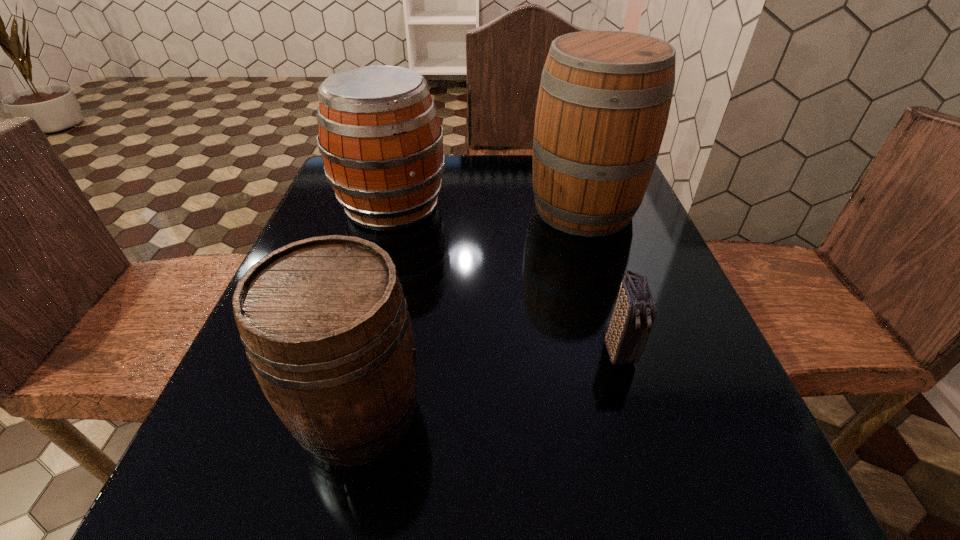
The width and height of the screenshot is (960, 540). In order to click on the tallest cider in this screenshot , I will do `click(604, 99)`.

The image size is (960, 540). Find the location of `the rightmost cider`. the rightmost cider is located at coordinates (604, 99).

Find the location of a particular element. The width and height of the screenshot is (960, 540). the nearest cider is located at coordinates (326, 328).

What are the coordinates of `clutch bag` in the screenshot? It's located at (635, 311).

At what (x,y) coordinates should I click in order to perform the action: click on vacant position located 0.330m on the front of the rightmost cider. Please return your answer as a coordinate pair (x, y). Looking at the image, I should click on (635, 373).

This screenshot has height=540, width=960. I want to click on free space located 0.300m on the side of the nearest cider near the bung hole, so click(x=636, y=413).

This screenshot has width=960, height=540. Find the location of `blank area located 0.180m with the zip open on the clutch bag`. blank area located 0.180m with the zip open on the clutch bag is located at coordinates (661, 493).

At what (x,y) coordinates should I click in order to perform the action: click on object located in the near edge section of the desktop. Please return your answer as a coordinate pair (x, y). This screenshot has height=540, width=960. Looking at the image, I should click on (326, 328).

This screenshot has width=960, height=540. What are the coordinates of `cider located in the right edge section of the desktop` in the screenshot? It's located at (604, 99).

Identify the location of clutch bag that is at the right edge. (635, 311).